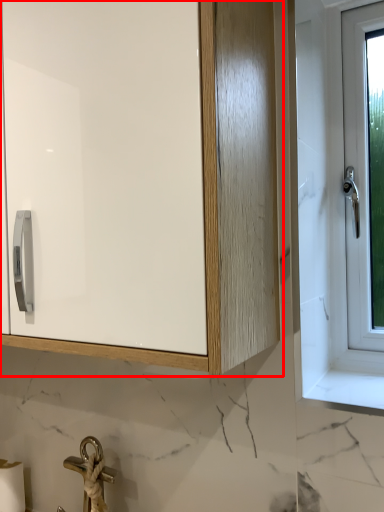
Question: Observing the image, what is the correct spatial positioning of cabinetry (annotated by the red box) in reference to toilet paper?

Choices:
 (A) right
 (B) left

Answer: (A)